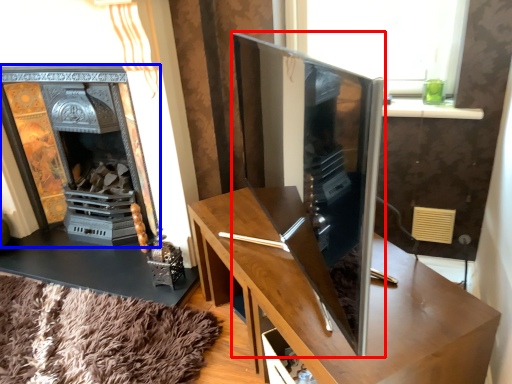
Question: Which of the following is the farthest to the observer, tv cabinet (highlighted by a red box) or fireplace (highlighted by a blue box)?

Choices:
 (A) tv cabinet
 (B) fireplace

Answer: (B)